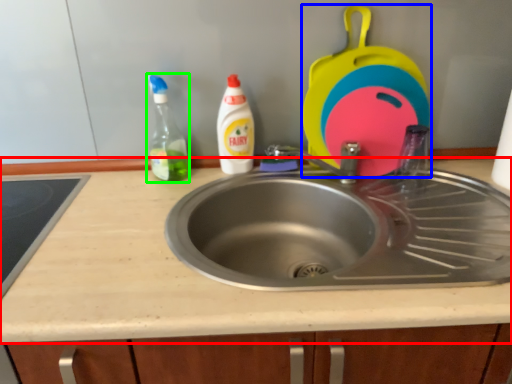
Question: Based on their relative distances, which object is farther from countertop (highlighted by a red box)? Choose from appliance (highlighted by a blue box) and cleaning product (highlighted by a green box).

Choices:
 (A) appliance
 (B) cleaning product

Answer: (A)